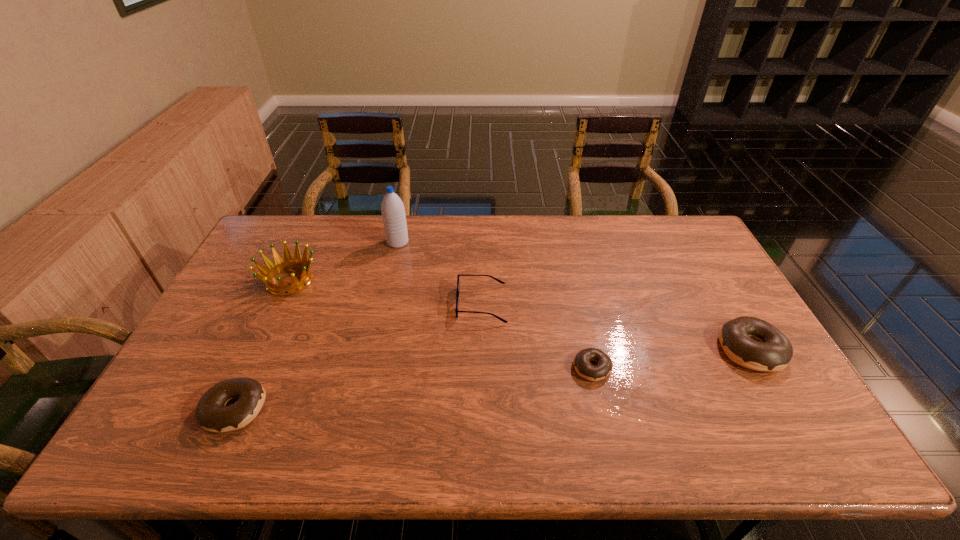
If the aim is uniform spacing by inserting an additional doughnut among them, please point to a vacant space for this new doughnut. Please provide its 2D coordinates. Your answer should be formatted as a tuple, i.e. [(x, y)], where the tuple contains the x and y coordinates of a point satisfying the conditions above.

[(420, 387)]